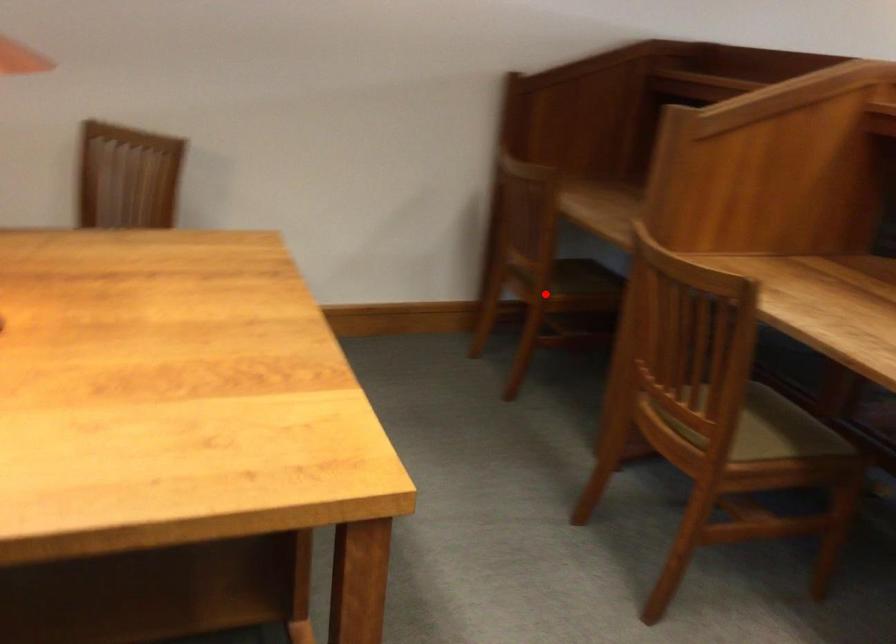
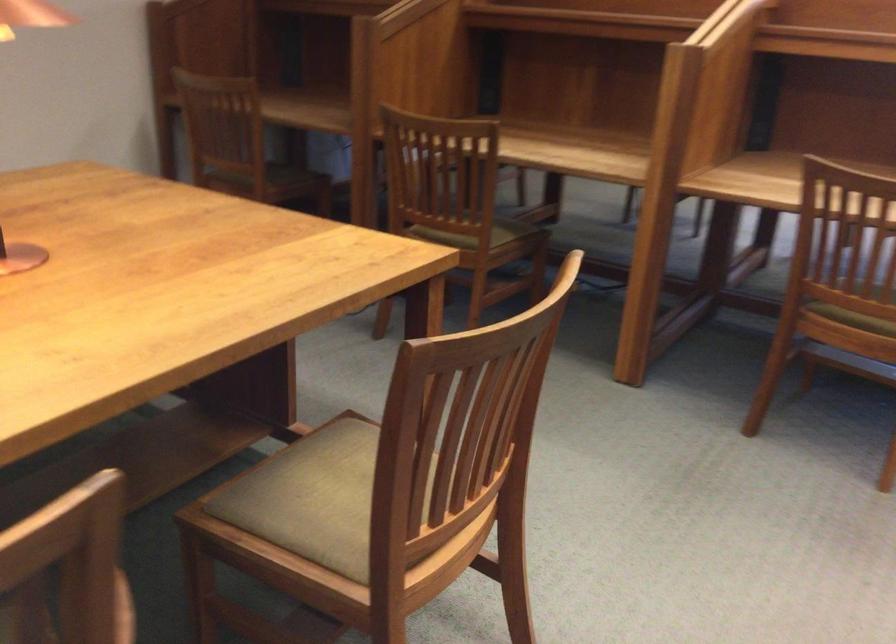
Where in the second image is the point corresponding to the highlighted location from the first image?

(264, 182)